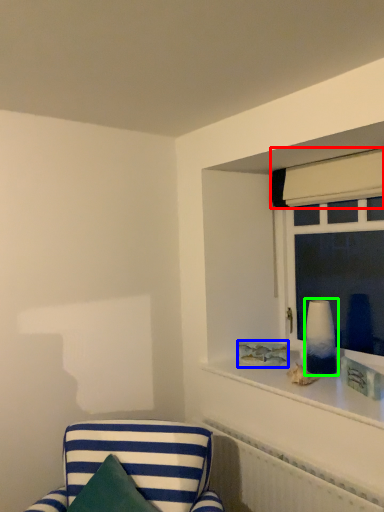
Question: Which object is positioned closest to curtain (highlighted by a red box)? Select from picture frame (highlighted by a blue box) and table lamp (highlighted by a green box).

Choices:
 (A) picture frame
 (B) table lamp

Answer: (B)